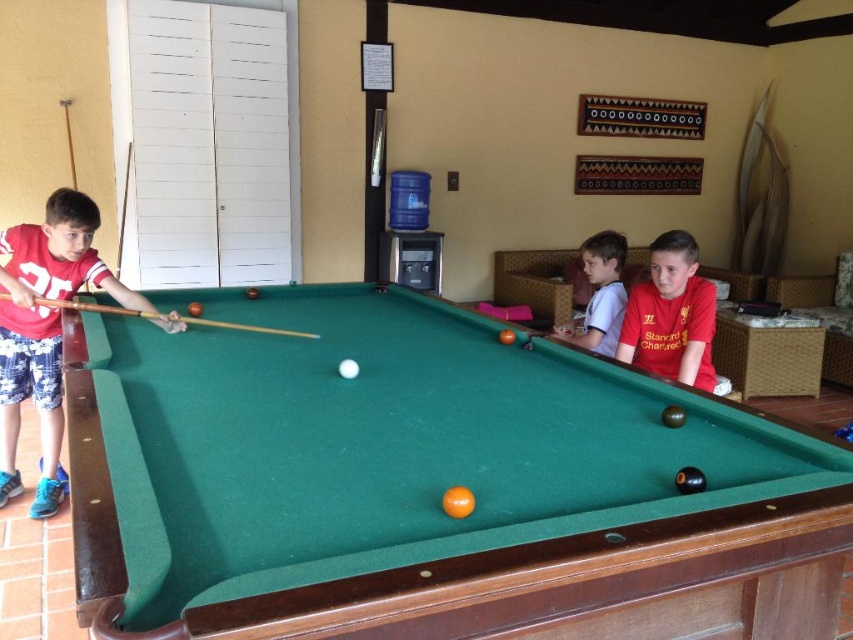
Between point (575, 506) and point (590, 328), which one is positioned behind?

The point (590, 328) is behind.

Can you confirm if green felt pool table at center is smaller than white cotton shirt at upper right?

Incorrect, green felt pool table at center is not smaller in size than white cotton shirt at upper right.

Who is more forward, (238,577) or (589,308)?

Point (238,577) is more forward.

You are a GUI agent. You are given a task and a screenshot of the screen. Output one action in this format:
    pyautogui.click(x=<x>, y=<y>)
    Task: Click on the green felt pool table at center
    
    Given the screenshot: What is the action you would take?
    pos(431,483)

Looking at this image, does matte red shirt at center have a greater height compared to wooden cue at left?

Yes, matte red shirt at center is taller than wooden cue at left.

Can you confirm if matte red shirt at center is smaller than wooden cue at left?

Actually, matte red shirt at center might be larger than wooden cue at left.

Who is more forward, (706, 348) or (281, 332)?

Point (281, 332)

Where is `matte red shirt at center`? This screenshot has width=853, height=640. matte red shirt at center is located at coordinates (671, 316).

Is matte red shirt at left taller than wooden cue at left?

Correct, matte red shirt at left is much taller as wooden cue at left.

Is point (9, 396) positioned after point (207, 323)?

That is True.

Does point (9, 413) come behind point (239, 324)?

Yes, it is behind point (239, 324).

The image size is (853, 640). What are the coordinates of `matte red shirt at left` in the screenshot? It's located at (44, 330).